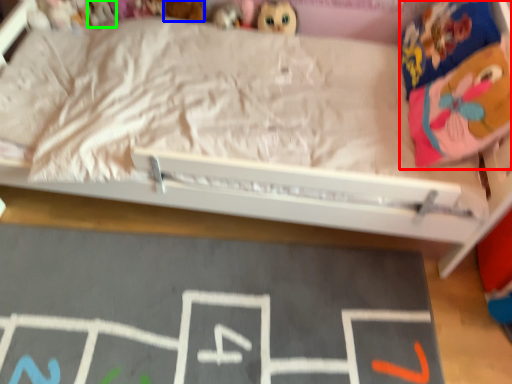
Question: Based on their relative distances, which object is nearer to stuff (highlighted by a red box)? Choose from toy (highlighted by a blue box) and toy (highlighted by a green box).

Choices:
 (A) toy
 (B) toy

Answer: (A)